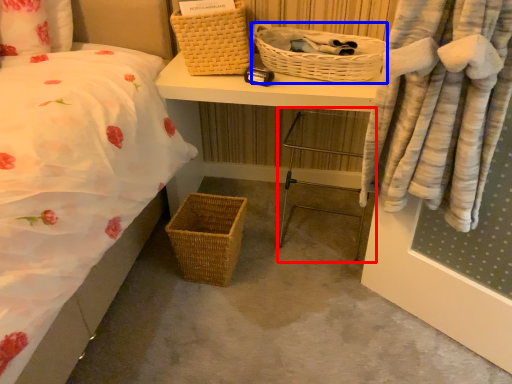
Question: Among these objects, which one is nearest to the camera, chair (highlighted by a red box) or picnic basket (highlighted by a blue box)?

Choices:
 (A) chair
 (B) picnic basket

Answer: (B)